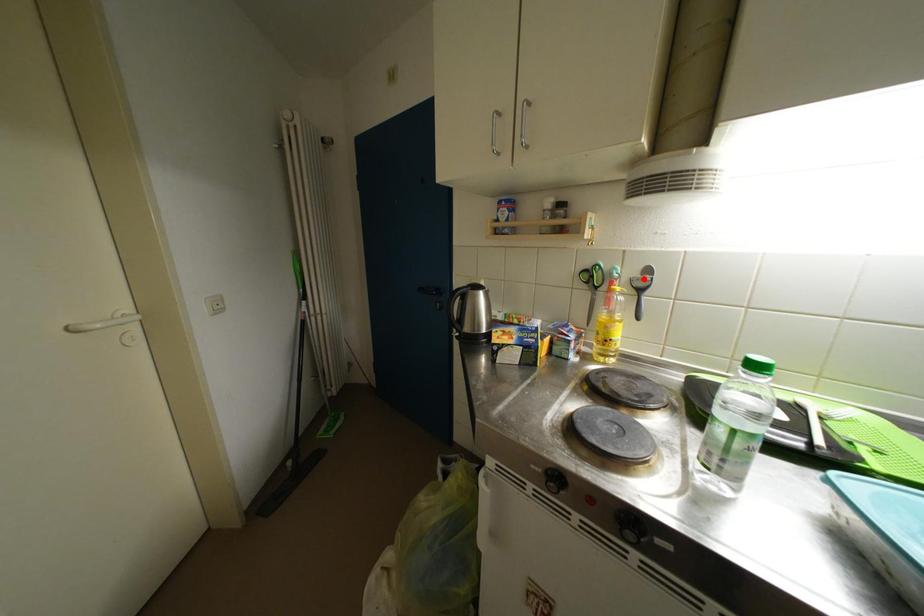
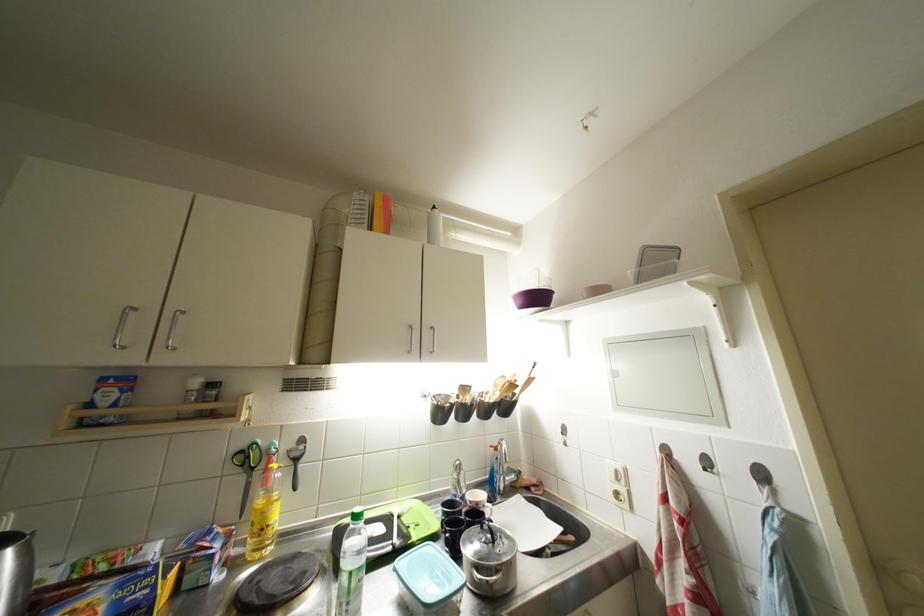
Find the pixel in the second image that matches the highlighted location in the first image.

(299, 450)